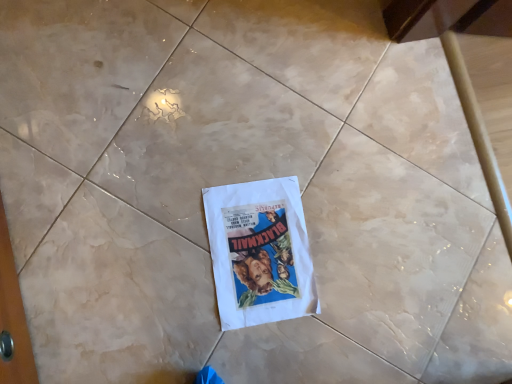
Find the location of a particular element. This screenshot has width=512, height=384. unoccupied area behind white paper flyer at center is located at coordinates (324, 169).